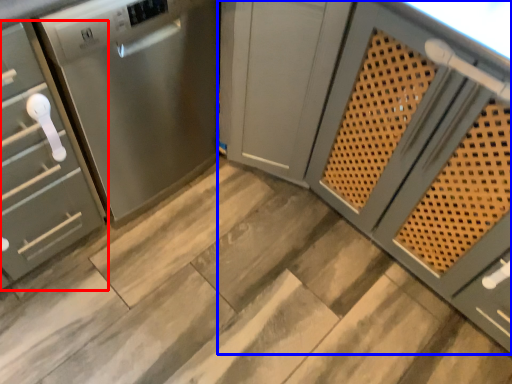
Question: Which of the following is the closest to the observer, cabinetry (highlighted by a red box) or cabinetry (highlighted by a blue box)?

Choices:
 (A) cabinetry
 (B) cabinetry

Answer: (B)